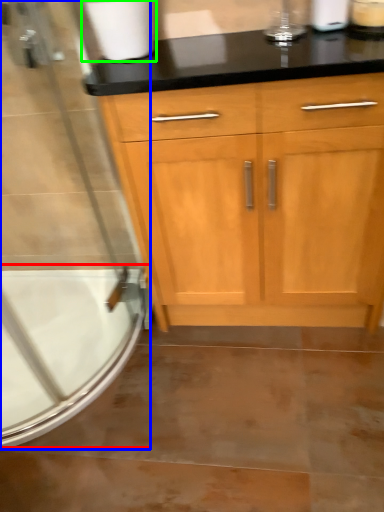
Question: Considering the real-world distances, which object is farthest from bath (highlighted by a red box)? screen door (highlighted by a blue box) or toilet paper (highlighted by a green box)?

Choices:
 (A) screen door
 (B) toilet paper

Answer: (B)